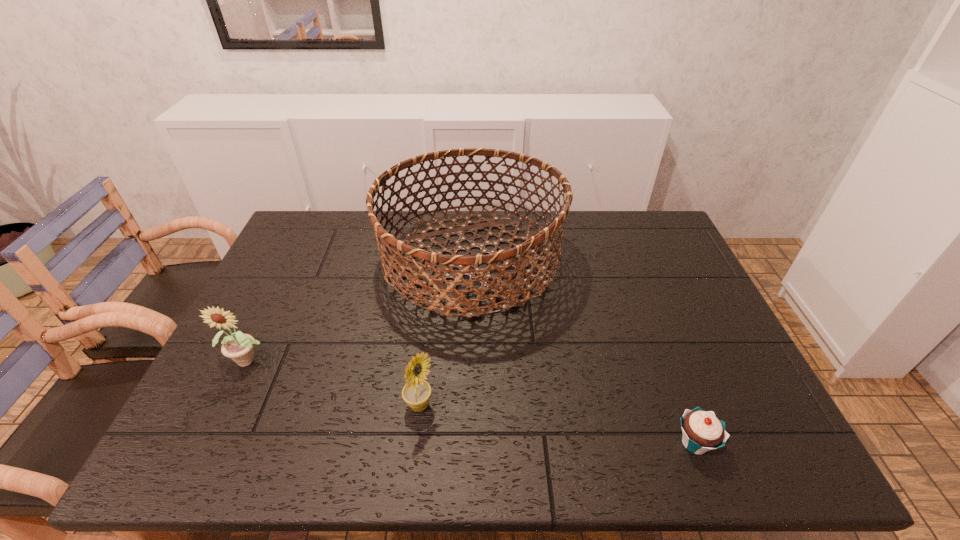
The image size is (960, 540). In order to click on free space located on the face of the right sunflower in this screenshot , I will do `click(482, 406)`.

In order to click on vacant point located 0.380m on the left of the cupcake in this screenshot , I will do `click(496, 443)`.

You are a GUI agent. You are given a task and a screenshot of the screen. Output one action in this format:
    pyautogui.click(x=<x>, y=<y>)
    Task: Click on the object situated at the far edge
    The image size is (960, 540).
    Given the screenshot: What is the action you would take?
    pyautogui.click(x=454, y=298)

Where is `object at the near edge`? This screenshot has width=960, height=540. object at the near edge is located at coordinates click(x=701, y=431).

Identify the location of object located at the left edge. (239, 347).

Identify the location of object located at the right edge. The image size is (960, 540). [x=701, y=431].

This screenshot has height=540, width=960. What are the coordinates of `object located at the near right corner` in the screenshot? It's located at [701, 431].

I want to click on vacant space at the far edge of the desktop, so click(423, 244).

In the image, there is a desktop. At what (x,y) coordinates should I click in order to perform the action: click on free region at the near edge. Please return your answer as a coordinate pair (x, y). Looking at the image, I should click on (414, 453).

Where is `free region at the left edge of the desktop`? This screenshot has width=960, height=540. free region at the left edge of the desktop is located at coordinates (285, 255).